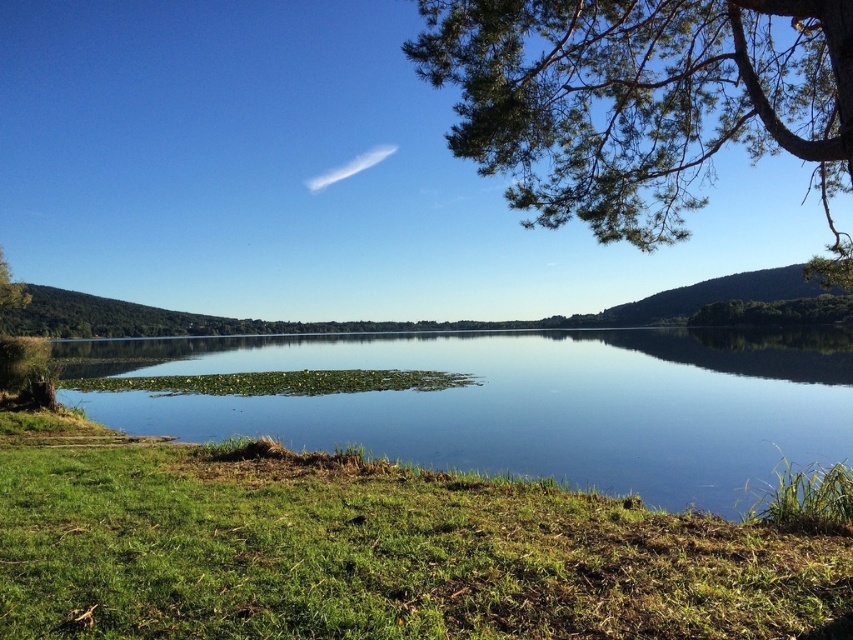
You are planning to set up a picnic blanket in the lakeside area. Given the presence of green grass at lower left and clear blue water at center, which location would provide a more stable surface for your blanket? Please consider the descriptions provided.

The clear blue water at center is a more stable surface for the picnic blanket because the green grass at lower left is thinner, making it less sturdy compared to the solid ground beneath the water.